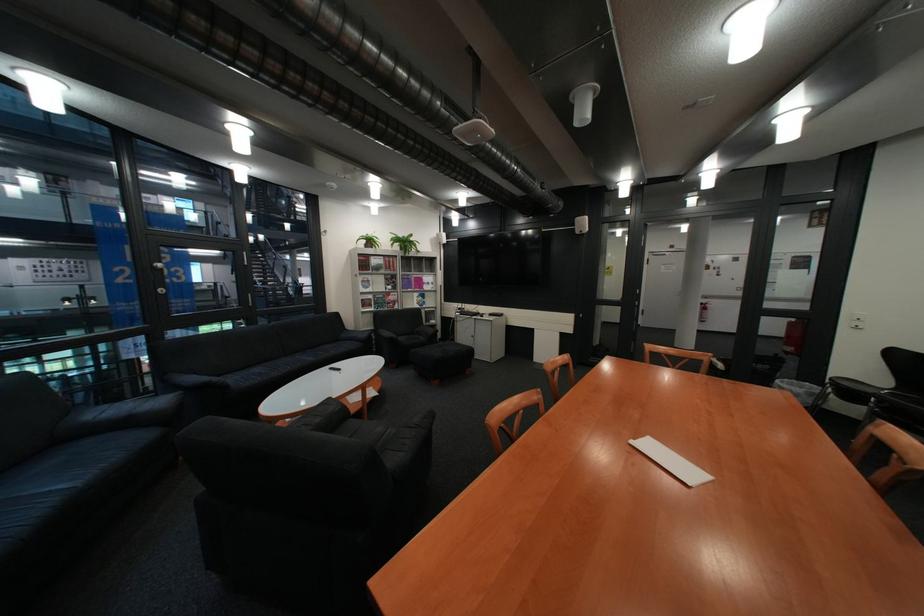
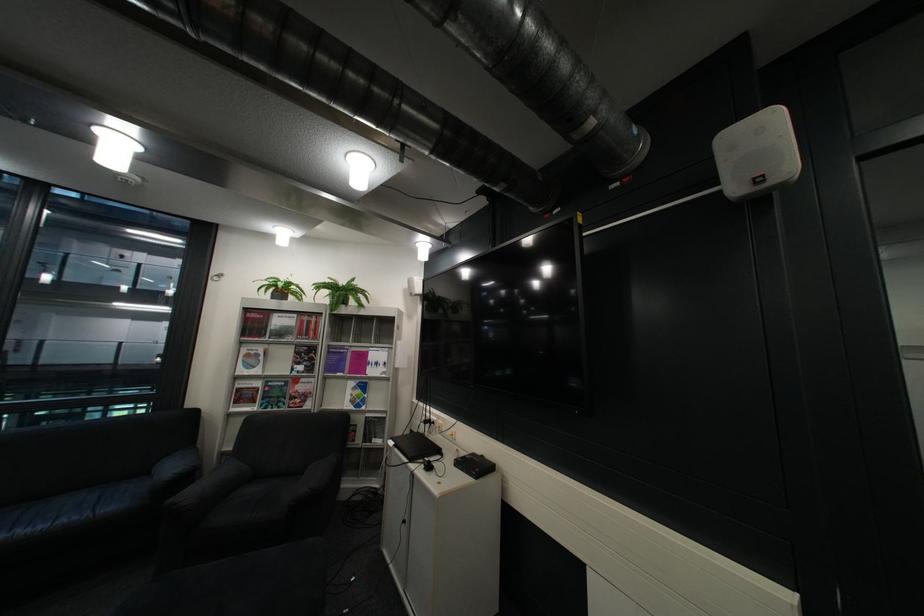
Locate, in the second image, the point that corresponds to (447,322) in the first image.

(393, 442)